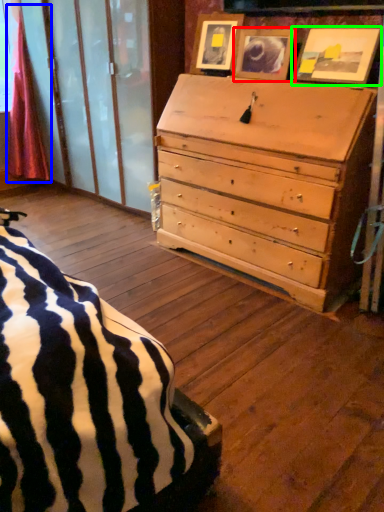
Question: Estimate the real-world distances between objects in this image. Which object is closer to picture frame (highlighted by a red box), curtain (highlighted by a blue box) or picture frame (highlighted by a green box)?

Choices:
 (A) curtain
 (B) picture frame

Answer: (B)